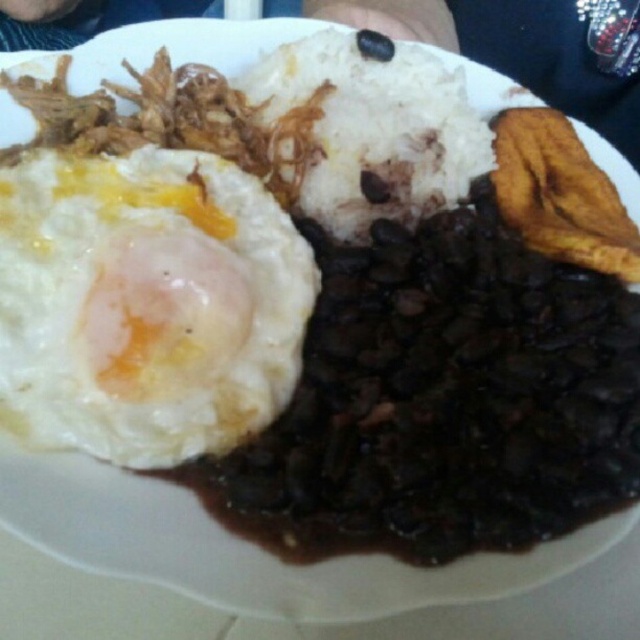
You are a food critic evaluating this dish. You need to describe the spatial arrangement of the white fluffy egg at upper left and the white matte rice at center. Which one is positioned lower on the plate?

The white fluffy egg at upper left is located below the white matte rice at center, so it is positioned lower on the plate.

Consider the image. You are a food critic evaluating the presentation of this dish. Based on the size comparison between the white fluffy egg at upper left and the white matte rice at center, which component do you think is the main focus of the dish?

The white fluffy egg at upper left is smaller than the white matte rice at center, so the main focus of the dish is likely the white matte rice at center since it occupies a larger portion on the plate.